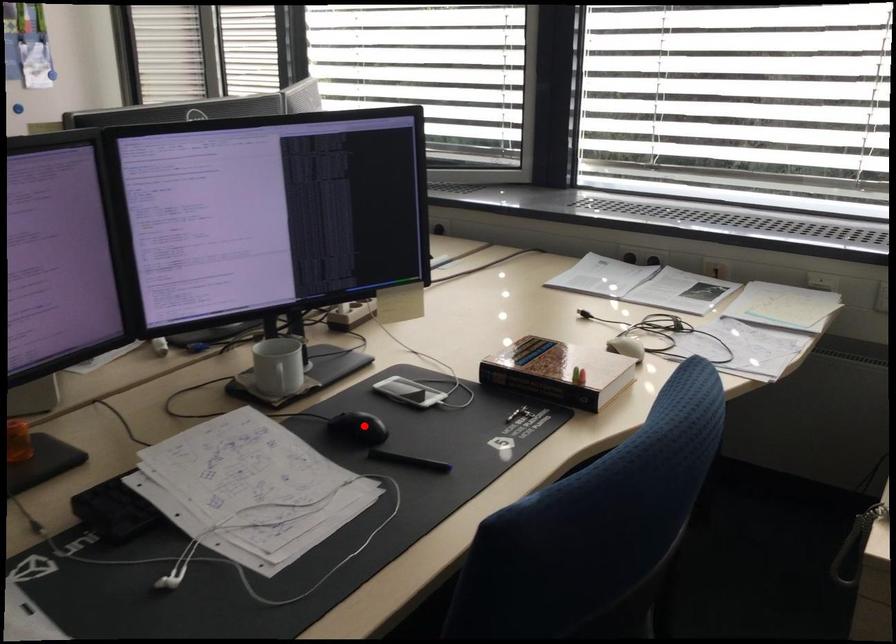
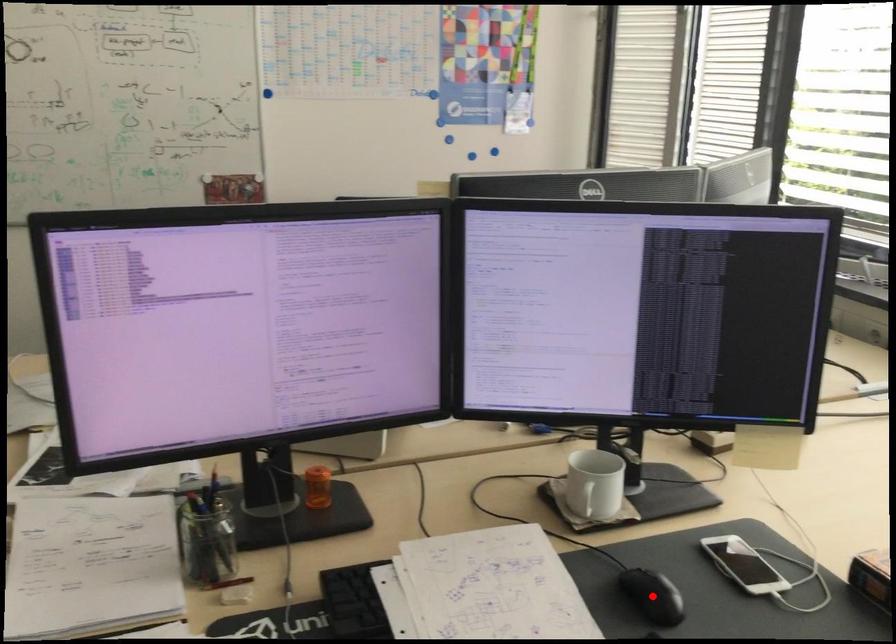
I am providing you with two images of the same scene from different viewpoints. A red point is marked on the first image and another point is marked on the second image. Do the highlighted points in image1 and image2 indicate the same real-world spot?

Yes